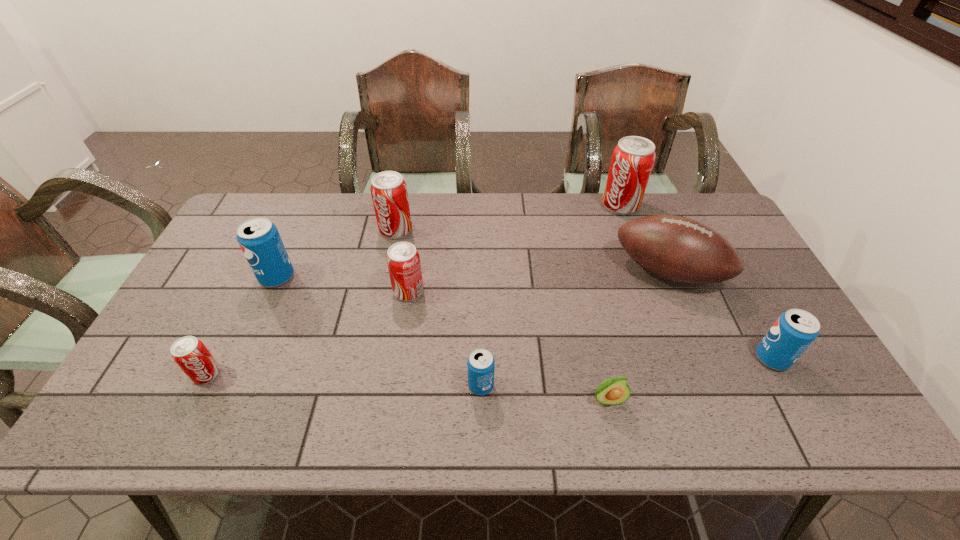
Locate an element on the screen. the rightmost red soda can is located at coordinates (633, 158).

Image resolution: width=960 pixels, height=540 pixels. Find the location of `the second soda can from right to left`. the second soda can from right to left is located at coordinates click(x=633, y=158).

Where is `the biggest blue soda can`? the biggest blue soda can is located at coordinates (259, 239).

The height and width of the screenshot is (540, 960). In order to click on the farthest blue soda can in this screenshot , I will do `click(259, 239)`.

Where is `the third smallest red soda can`? This screenshot has width=960, height=540. the third smallest red soda can is located at coordinates point(388,189).

Find the location of `the second farthest soda can`. the second farthest soda can is located at coordinates (388, 189).

Locate an element on the screen. The width and height of the screenshot is (960, 540). football (American) is located at coordinates (678, 249).

Locate an element on the screen. The height and width of the screenshot is (540, 960). the second nearest red soda can is located at coordinates (403, 261).

What are the coordinates of `the rightmost blue soda can` in the screenshot? It's located at (794, 331).

Where is `the rightmost soda can`? Image resolution: width=960 pixels, height=540 pixels. the rightmost soda can is located at coordinates (794, 331).